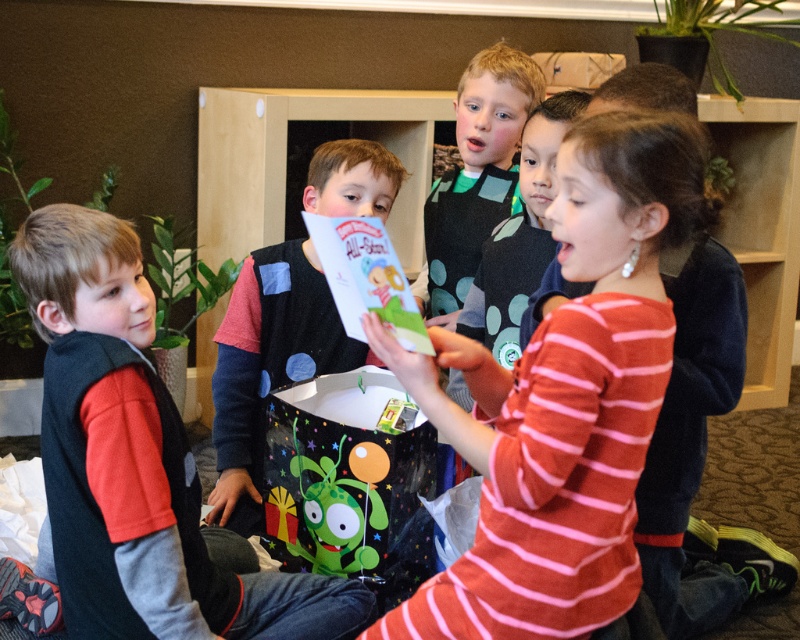
Who is lower down, pink striped sweater at center or matte black vest at center?

pink striped sweater at center is lower down.

Who is more forward, (602, 616) or (233, 451)?

Result: Point (602, 616) is in front.

Locate an element on the screen. This screenshot has width=800, height=640. pink striped sweater at center is located at coordinates (564, 397).

The width and height of the screenshot is (800, 640). I want to click on pink striped sweater at center, so click(x=564, y=397).

Is point (136, 259) farther from camera compared to point (368, 484)?

That is False.

Does velvet black vest at left have a larger size compared to green matte plush toy at center?

Yes, velvet black vest at left is bigger than green matte plush toy at center.

Between point (152, 513) and point (344, 436), which one is positioned behind?

The point (344, 436) is behind.

The image size is (800, 640). What are the coordinates of `velvet black vest at left` in the screenshot? It's located at (136, 460).

Which of these two, pink striped sweater at center or velvet black vest at left, stands taller?

With more height is velvet black vest at left.

Between point (620, 316) and point (158, 500), which one is positioned in front?

Point (620, 316) is in front.

This screenshot has height=640, width=800. I want to click on pink striped sweater at center, so click(564, 397).

Where is `pink striped sweater at center`? Image resolution: width=800 pixels, height=640 pixels. pink striped sweater at center is located at coordinates 564,397.